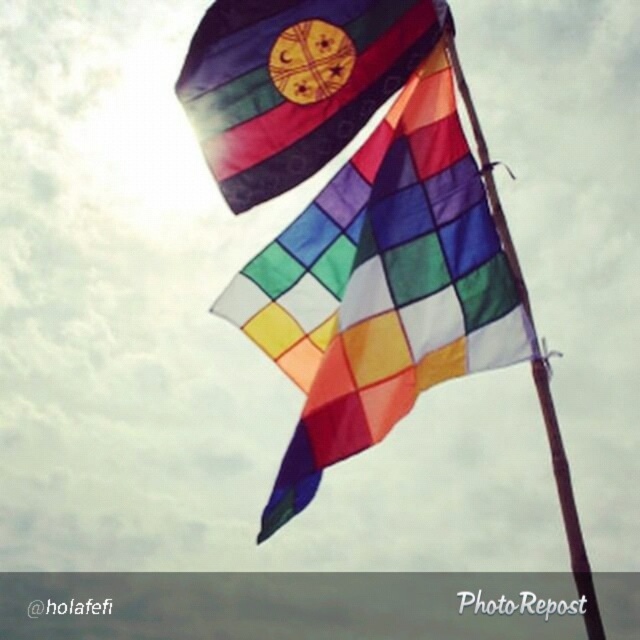
Looking at this image, you are standing at the base of the textured fabric flag at upper center and want to throw a ball to your friend who is standing at the base of the other flag. If the ball travels in a straight line, will it pass between the two flags?

The distance between the two flags is 7.70 meters. Since the ball travels in a straight line between them, it will pass between the textured fabric flag at upper center and the other flag.

You are a photographer trying to capture both the textured fabric flag at upper center and the brown wooden pole at center in a single shot. Given that the flag is smaller than the pole, where should you position yourself relative to the two objects to ensure both are clearly visible in your photo?

Since the textured fabric flag at upper center is smaller than the brown wooden pole at center, you should position yourself closer to the textured fabric flag at upper center to ensure both objects are captured clearly in the photograph.